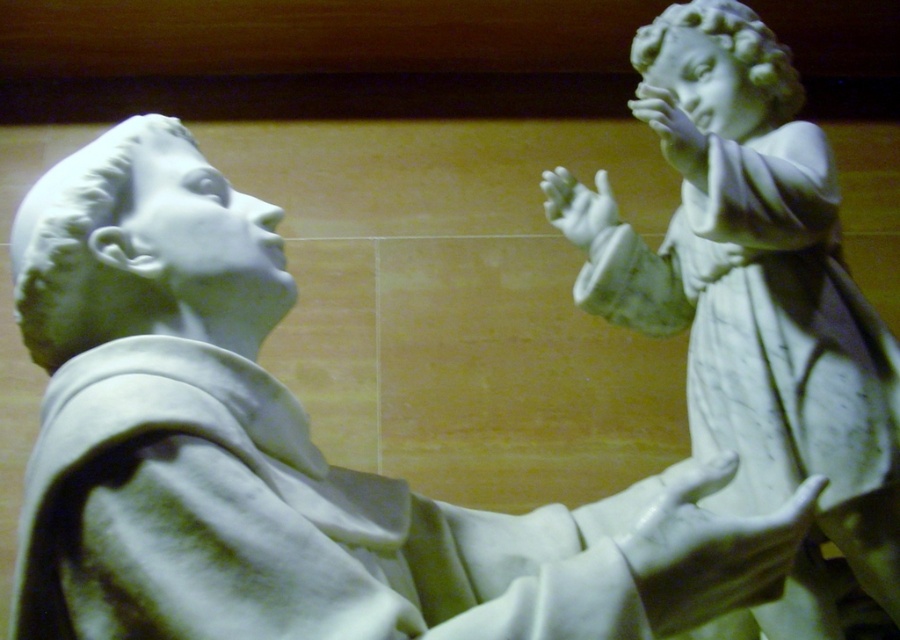
Which of these two, white marble hand at lower right or white marble hand at center, stands taller?

white marble hand at lower right

Is point (757, 532) behind point (578, 211)?

No, it is not.

Where is `white marble hand at lower right`? The width and height of the screenshot is (900, 640). white marble hand at lower right is located at coordinates (711, 550).

Who is lower down, white marble statue at right or white marble hand at center?

white marble statue at right is lower down.

Is white marble statue at right in front of white marble hand at center?

Yes, white marble statue at right is in front of white marble hand at center.

Where is `white marble statue at right`? white marble statue at right is located at coordinates (762, 292).

Between white marble statue at right and white marble hand at upper right, which one has less height?

Result: With less height is white marble hand at upper right.

The width and height of the screenshot is (900, 640). In order to click on white marble statue at right in this screenshot , I will do `click(762, 292)`.